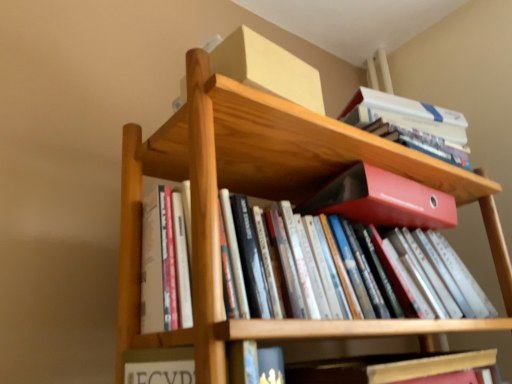
Where is `white paperback book at upper right, which appears as the second book when ordered from the bottom`? Image resolution: width=512 pixels, height=384 pixels. white paperback book at upper right, which appears as the second book when ordered from the bottom is located at coordinates (410, 124).

What is the approximate height of wooden bookshelf at center?

wooden bookshelf at center is 8.71 inches tall.

The width and height of the screenshot is (512, 384). What do you see at coordinates (386, 367) in the screenshot?
I see `hardcover book at lower center, positioned as the first book in front-to-back order` at bounding box center [386, 367].

The height and width of the screenshot is (384, 512). Describe the element at coordinates (383, 200) in the screenshot. I see `matte red folder at center` at that location.

The image size is (512, 384). What are the coordinates of `white paperback book at upper right, the first book from the back` in the screenshot? It's located at (410, 124).

Can you tell me how much hardcover book at lower center, which ranks as the second book in back-to-front order, and white paperback book at upper right, marked as the second book in a front-to-back arrangement, differ in facing direction?

12.5 degrees.

Is white paperback book at upper right, marked as the second book in a front-to-back arrangement, at the back of hardcover book at lower center, positioned as the second book in top-to-bottom order?

No, hardcover book at lower center, positioned as the second book in top-to-bottom order, is not facing the opposite direction of white paperback book at upper right, marked as the second book in a front-to-back arrangement.

Is hardcover book at lower center, positioned as the first book in front-to-back order, at the left side of white paperback book at upper right, which appears as the second book when ordered from the bottom?

Indeed, hardcover book at lower center, positioned as the first book in front-to-back order, is positioned on the left side of white paperback book at upper right, which appears as the second book when ordered from the bottom.

From a real-world perspective, is hardcover book at lower center, which is counted as the first book, starting from the bottom, positioned over white paperback book at upper right, marked as the second book in a front-to-back arrangement, based on gravity?

Actually, hardcover book at lower center, which is counted as the first book, starting from the bottom, is physically below white paperback book at upper right, marked as the second book in a front-to-back arrangement, in the real world.

In the scene shown: Can you confirm if wooden bookshelf at center is wider than matte red folder at center?

No, wooden bookshelf at center is not wider than matte red folder at center.

Considering the sizes of objects wooden bookshelf at center and matte red folder at center in the image provided, who is taller, wooden bookshelf at center or matte red folder at center?

wooden bookshelf at center is taller.

Is wooden bookshelf at center inside the boundaries of matte red folder at center, or outside?

wooden bookshelf at center is located beyond the bounds of matte red folder at center.

Could you measure the distance between hardcover book at lower center, positioned as the second book in top-to-bottom order, and matte red folder at center?

11.51 inches.

Is hardcover book at lower center, positioned as the second book in top-to-bottom order, further to camera compared to matte red folder at center?

No, it is not.

Identify the location of paperback book that is above the hardcover book at lower center, which ranks as the second book in back-to-front order (from a real-world perspective). (383, 200).

Considering the positions of point (297, 365) and point (362, 176), is point (297, 365) closer or farther from the camera than point (362, 176)?

Point (297, 365) is closer to the camera than point (362, 176).

Is wooden bookshelf at center not inside hardcover book at lower center, which ranks as the second book in back-to-front order?

wooden bookshelf at center is positioned outside hardcover book at lower center, which ranks as the second book in back-to-front order.

Based on their sizes in the image, would you say wooden bookshelf at center is bigger or smaller than hardcover book at lower center, which ranks as the second book in back-to-front order?

Considering their sizes, wooden bookshelf at center takes up more space than hardcover book at lower center, which ranks as the second book in back-to-front order.

This screenshot has width=512, height=384. I want to click on bookcase that is above the hardcover book at lower center, which is counted as the first book, starting from the bottom (from a real-world perspective), so click(262, 197).

Is wooden bookshelf at center with hardcover book at lower center, positioned as the first book in front-to-back order?

wooden bookshelf at center and hardcover book at lower center, positioned as the first book in front-to-back order, are not in contact.

Could you tell me if white paperback book at upper right, positioned as the first book in top-to-bottom order, is facing wooden bookshelf at center?

No, white paperback book at upper right, positioned as the first book in top-to-bottom order, is not facing towards wooden bookshelf at center.

Can we say white paperback book at upper right, the first book from the back, lies outside wooden bookshelf at center?

Yes, white paperback book at upper right, the first book from the back, is located beyond the bounds of wooden bookshelf at center.

Can you confirm if white paperback book at upper right, positioned as the first book in top-to-bottom order, is smaller than wooden bookshelf at center?

Yes, white paperback book at upper right, positioned as the first book in top-to-bottom order, is smaller than wooden bookshelf at center.

From the picture: Between white paperback book at upper right, marked as the second book in a front-to-back arrangement, and wooden bookshelf at center, which one has less height?

white paperback book at upper right, marked as the second book in a front-to-back arrangement.

Is wooden bookshelf at center at the back of matte red folder at center?

No, matte red folder at center is not facing the opposite direction of wooden bookshelf at center.

Are matte red folder at center and wooden bookshelf at center located far from each other?

No, matte red folder at center is in close proximity to wooden bookshelf at center.

Considering the positions of point (351, 211) and point (206, 72), is point (351, 211) closer or farther from the camera than point (206, 72)?

Clearly, point (351, 211) is more distant from the camera than point (206, 72).

From a real-world perspective, is hardcover book at lower center, which is counted as the first book, starting from the bottom, positioned under wooden bookshelf at center based on gravity?

Yes, from a real-world perspective, hardcover book at lower center, which is counted as the first book, starting from the bottom, is beneath wooden bookshelf at center.

From the wooden bookshelf at center, count 1st book to the right and point to it. Please provide its 2D coordinates.

[(386, 367)]

Considering their positions, is hardcover book at lower center, positioned as the second book in top-to-bottom order, located in front of or behind wooden bookshelf at center?

In the image, hardcover book at lower center, positioned as the second book in top-to-bottom order, appears behind wooden bookshelf at center.

This screenshot has height=384, width=512. Find the location of `book on the right of hardcover book at lower center, positioned as the second book in top-to-bottom order`. book on the right of hardcover book at lower center, positioned as the second book in top-to-bottom order is located at coordinates (410, 124).

Where is `bookcase that is under the matte red folder at center (from a real-world perspective)`? bookcase that is under the matte red folder at center (from a real-world perspective) is located at coordinates (262, 197).

When comparing their distances from wooden bookshelf at center, does matte red folder at center or hardcover book at lower center, which is counted as the first book, starting from the bottom, seem closer?

matte red folder at center is closer to wooden bookshelf at center.

Looking at this image, looking at the image, which one is located closer to white paperback book at upper right, positioned as the first book in top-to-bottom order, matte red folder at center or wooden bookshelf at center?

Among the two, matte red folder at center is located nearer to white paperback book at upper right, positioned as the first book in top-to-bottom order.

Looking at the image, which one is located further to white paperback book at upper right, the first book from the back, hardcover book at lower center, which is counted as the first book, starting from the bottom, or matte red folder at center?

Among the two, hardcover book at lower center, which is counted as the first book, starting from the bottom, is located further to white paperback book at upper right, the first book from the back.

From the image, which object appears to be farther from matte red folder at center, wooden bookshelf at center or hardcover book at lower center, which is counted as the first book, starting from the bottom?

Among the two, hardcover book at lower center, which is counted as the first book, starting from the bottom, is located further to matte red folder at center.

Which object lies nearer to the anchor point wooden bookshelf at center, hardcover book at lower center, positioned as the first book in front-to-back order, or matte red folder at center?

matte red folder at center is positioned closer to the anchor wooden bookshelf at center.

Looking at the image, which one is located closer to wooden bookshelf at center, matte red folder at center or white paperback book at upper right, positioned as the first book in top-to-bottom order?

matte red folder at center is closer to wooden bookshelf at center.

Considering their positions, is wooden bookshelf at center positioned further to white paperback book at upper right, which appears as the second book when ordered from the bottom, than matte red folder at center?

wooden bookshelf at center is positioned further to the anchor white paperback book at upper right, which appears as the second book when ordered from the bottom.

Based on the photo, considering their positions, is wooden bookshelf at center positioned closer to hardcover book at lower center, which is counted as the first book, starting from the bottom, than white paperback book at upper right, positioned as the first book in top-to-bottom order?

wooden bookshelf at center.

This screenshot has height=384, width=512. In order to click on paperback book positioned between wooden bookshelf at center and white paperback book at upper right, the first book from the back, from near to far in this screenshot , I will do `click(383, 200)`.

I want to click on paperback book that lies between white paperback book at upper right, positioned as the first book in top-to-bottom order, and hardcover book at lower center, positioned as the first book in front-to-back order, from top to bottom, so point(383,200).

Find the location of a particular element. This screenshot has height=384, width=512. bookcase between white paperback book at upper right, the first book from the back, and hardcover book at lower center, positioned as the second book in top-to-bottom order, in the vertical direction is located at coordinates (262, 197).

Locate an element on the screen. The image size is (512, 384). bookcase that lies between matte red folder at center and hardcover book at lower center, which ranks as the second book in back-to-front order, from top to bottom is located at coordinates (262, 197).